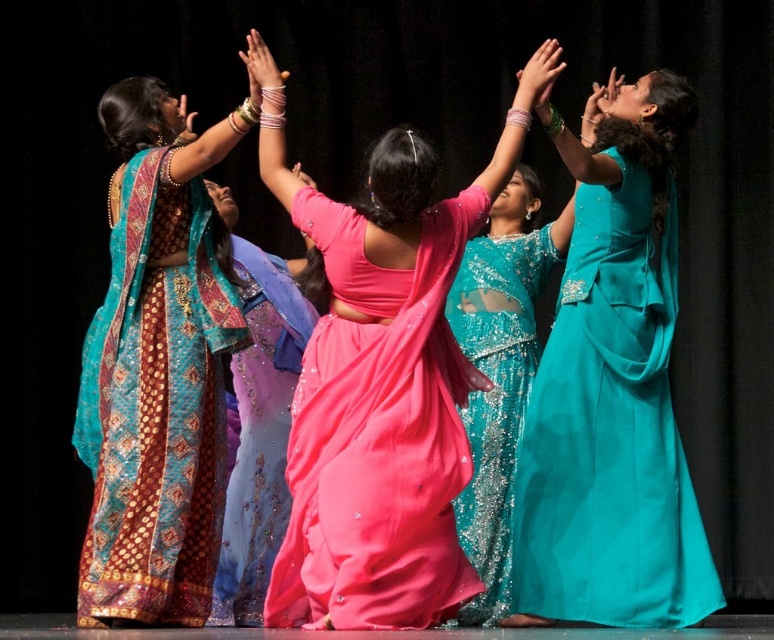
Is matte teal saree at left wider than teal sequined saree at center?

Yes, matte teal saree at left is wider than teal sequined saree at center.

Measure the distance between matte teal saree at left and teal sequined saree at center.

9.13 feet

In the scene shown: Measure the distance between point (88, 609) and camera.

Point (88, 609) and camera are 24.67 feet apart from each other.

Where is `matte teal saree at left`? matte teal saree at left is located at coordinates (156, 365).

Is pink satin saree at center behind teal sequined saree at center?

That is False.

Is point (382, 490) closer to camera compared to point (533, 356)?

That is True.

Locate an element on the screen. The height and width of the screenshot is (640, 774). pink satin saree at center is located at coordinates (382, 380).

Is point (163, 566) closer to viewer compared to point (581, 193)?

Yes, point (163, 566) is in front of point (581, 193).

Between matte teal saree at left and teal satin dress at upper right, which one is positioned higher?

Positioned higher is matte teal saree at left.

Who is more forward, (207, 292) or (701, 536)?

Positioned in front is point (207, 292).

Locate an element on the screen. matte teal saree at left is located at coordinates (156, 365).